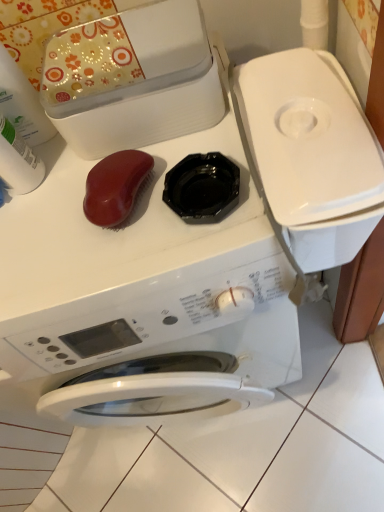
Find the location of `vacant region in front of white plastic bottle at upper left, which ranks as the second cleaning product in bottom-to-top order`. vacant region in front of white plastic bottle at upper left, which ranks as the second cleaning product in bottom-to-top order is located at coordinates (57, 231).